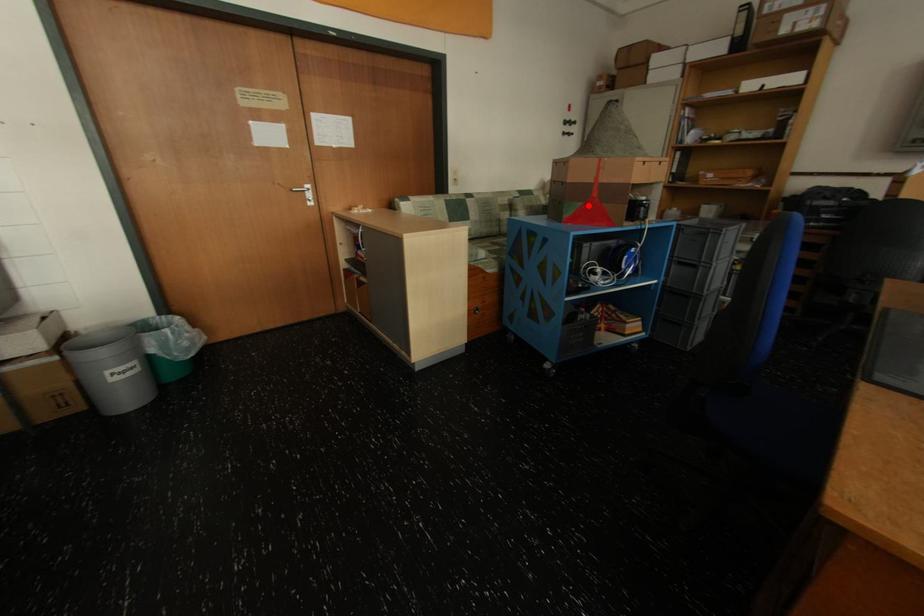
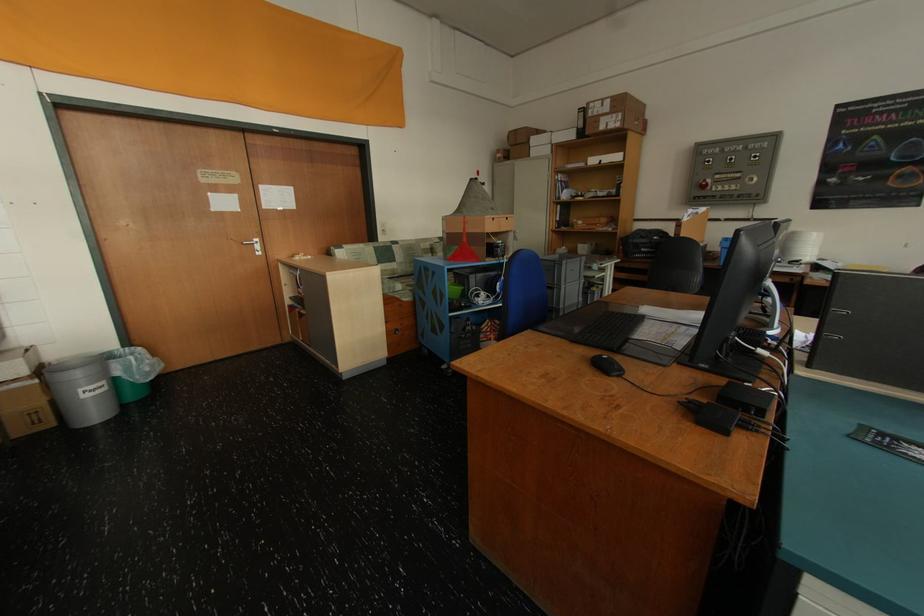
Question: I am providing you with two images of the same scene from different viewpoints. Image1 has a red point marked. In image2, the corresponding 3D location appears at what relative position? Reply with the corresponding letter.

Choices:
 (A) Closer
 (B) Farther

Answer: (A)